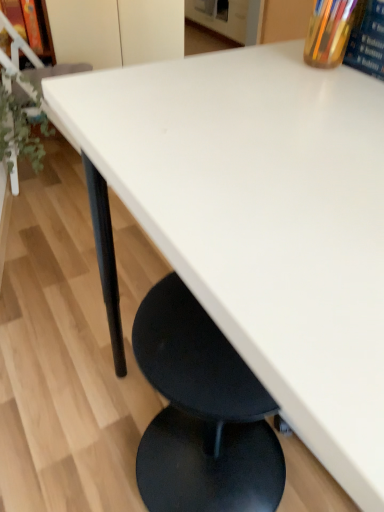
Question: From a real-world perspective, is matte wood shelf at upper left physically above green leafy plant at left?

Choices:
 (A) no
 (B) yes

Answer: (B)

Question: Is matte wood shelf at upper left oriented towards green leafy plant at left?

Choices:
 (A) no
 (B) yes

Answer: (B)

Question: From a real-world perspective, is matte wood shelf at upper left positioned under green leafy plant at left based on gravity?

Choices:
 (A) no
 (B) yes

Answer: (A)

Question: Is green leafy plant at left at the back of matte wood shelf at upper left?

Choices:
 (A) yes
 (B) no

Answer: (B)

Question: Is matte wood shelf at upper left smaller than green leafy plant at left?

Choices:
 (A) yes
 (B) no

Answer: (A)

Question: Does matte wood shelf at upper left lie behind green leafy plant at left?

Choices:
 (A) no
 (B) yes

Answer: (B)

Question: Is matte wood shelf at upper left behind translucent glass pen holder at upper right?

Choices:
 (A) no
 (B) yes

Answer: (B)

Question: Is the depth of matte wood shelf at upper left less than that of translucent glass pen holder at upper right?

Choices:
 (A) no
 (B) yes

Answer: (A)

Question: Is translucent glass pen holder at upper right surrounded by matte wood shelf at upper left?

Choices:
 (A) no
 (B) yes

Answer: (A)

Question: Considering the relative sizes of matte wood shelf at upper left and translucent glass pen holder at upper right in the image provided, is matte wood shelf at upper left bigger than translucent glass pen holder at upper right?

Choices:
 (A) yes
 (B) no

Answer: (A)

Question: Does matte wood shelf at upper left have a greater height compared to translucent glass pen holder at upper right?

Choices:
 (A) yes
 (B) no

Answer: (A)

Question: Is matte wood shelf at upper left turned away from translucent glass pen holder at upper right?

Choices:
 (A) yes
 (B) no

Answer: (B)

Question: Does green leafy plant at left turn towards matte wood shelf at upper left?

Choices:
 (A) no
 (B) yes

Answer: (A)